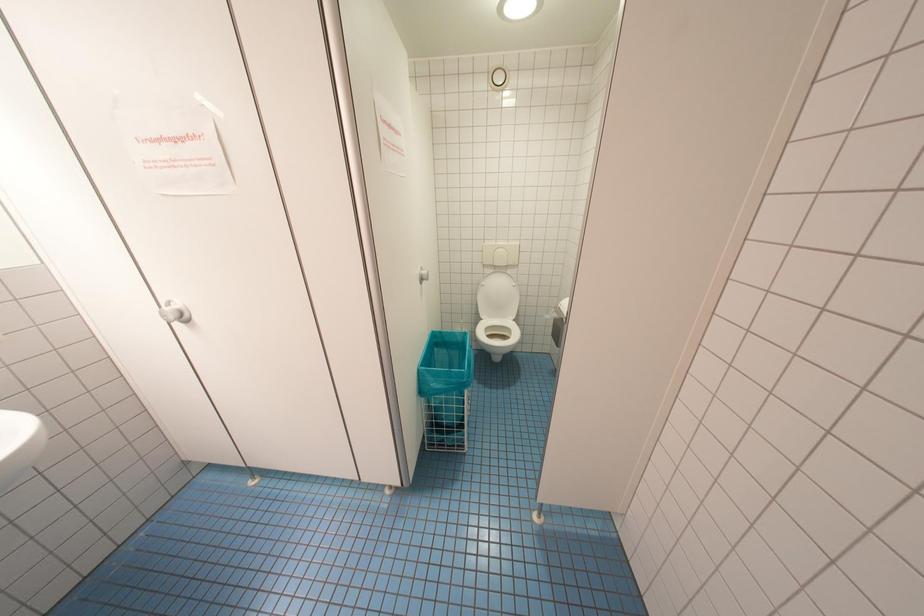
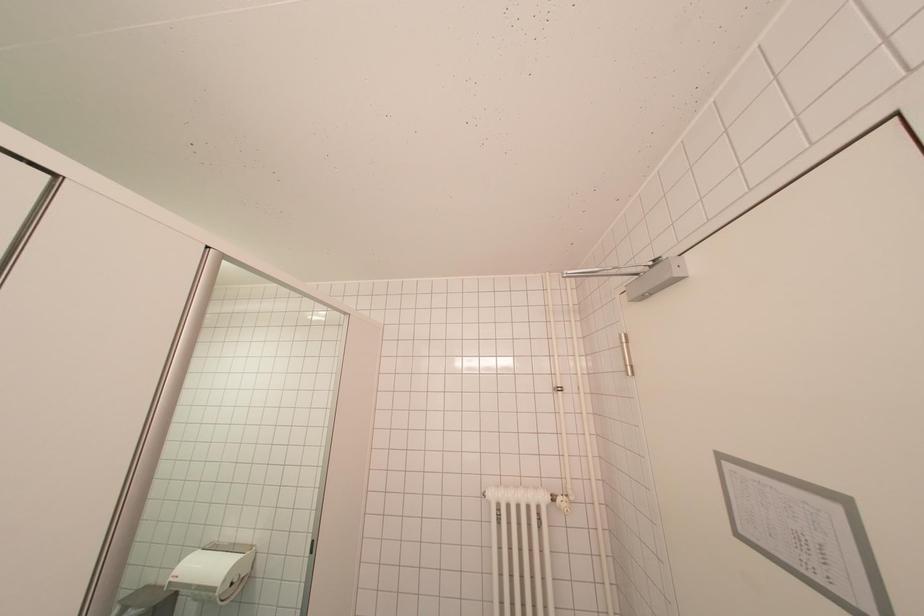
The images are taken continuously from a first-person perspective. In which direction is your viewpoint rotating?

The camera rotated toward right-up.